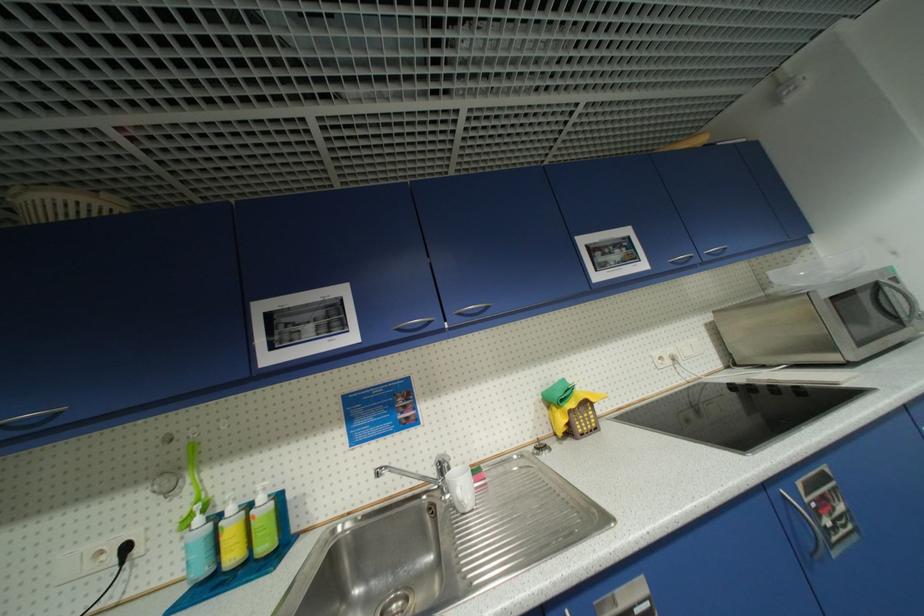
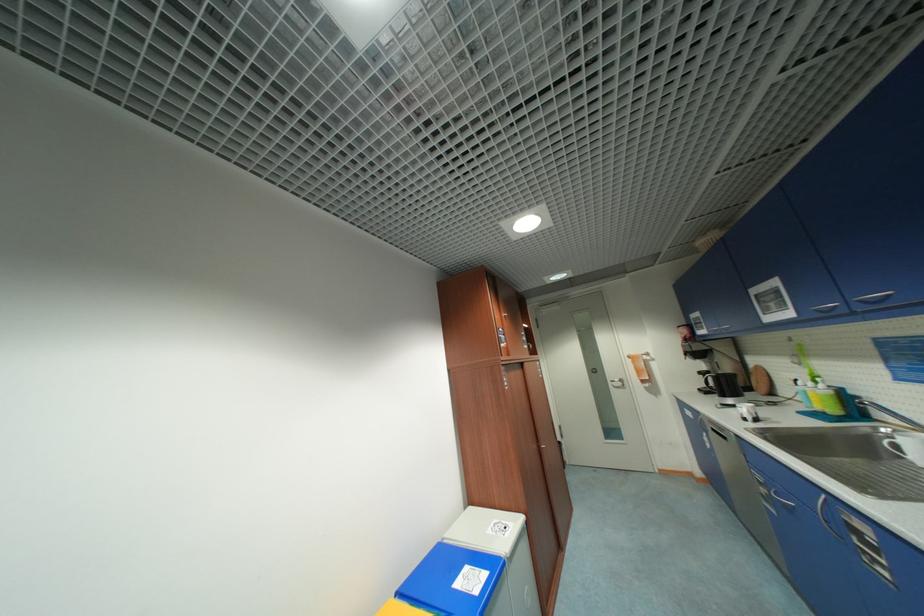
Find the pixel in the second image that matches point (466, 315) in the first image.

(867, 302)